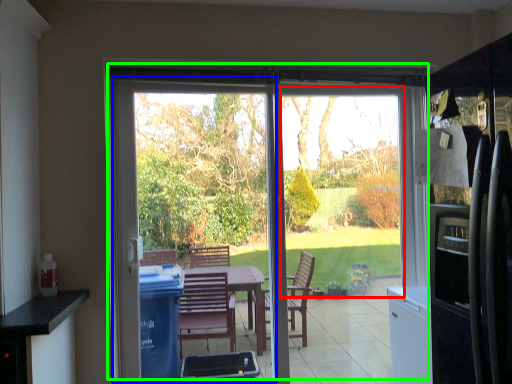
Question: Which is farther away from window screen (highlighted by a red box)? screen door (highlighted by a blue box) or door (highlighted by a green box)?

Choices:
 (A) screen door
 (B) door

Answer: (A)